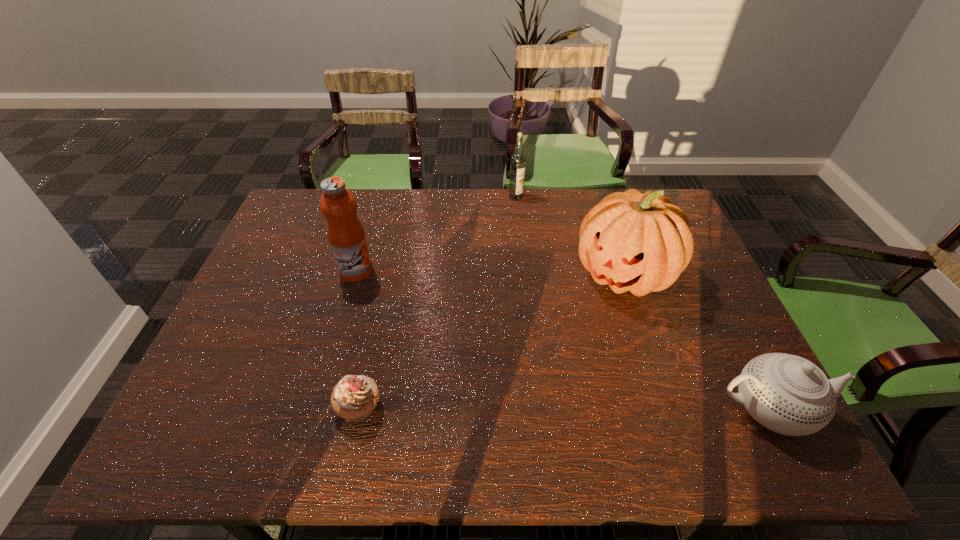
Locate an element on the screen. The height and width of the screenshot is (540, 960). vacant space that satisfies the following two spatial constraints: 1. on the front side of the second shortest object; 2. on the spout of the cupcake is located at coordinates (359, 409).

The width and height of the screenshot is (960, 540). I want to click on free space that satisfies the following two spatial constraints: 1. on the front side of the third shortest object; 2. on the spout of the chinaware, so click(x=537, y=409).

The image size is (960, 540). In order to click on free spot that satisfies the following two spatial constraints: 1. on the front side of the pumpkin; 2. on the right side of the third shortest object in this screenshot , I will do `click(523, 274)`.